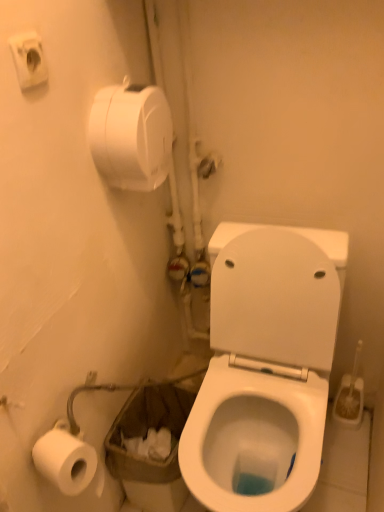
Question: From a real-world perspective, is white plastic toilet brush at right above or below white matte toilet paper at upper left?

Choices:
 (A) above
 (B) below

Answer: (B)

Question: From the image's perspective, is white plastic toilet brush at right above or below white matte toilet paper at upper left?

Choices:
 (A) below
 (B) above

Answer: (A)

Question: Which object is positioned closest to the white glossy toilet at center?

Choices:
 (A) white matte toilet paper at upper left
 (B) white plastic toilet brush at right

Answer: (B)

Question: Which object is positioned farthest from the white plastic toilet brush at right?

Choices:
 (A) white glossy toilet at center
 (B) white matte toilet paper at upper left

Answer: (B)